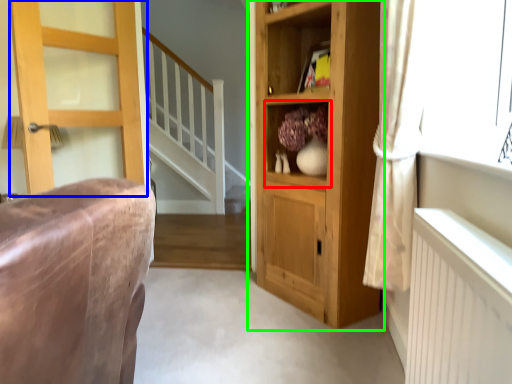
Question: Which object is positioned closest to cabinet (highlighted by a red box)? Select from door (highlighted by a blue box) and cupboard (highlighted by a green box).

Choices:
 (A) door
 (B) cupboard

Answer: (B)